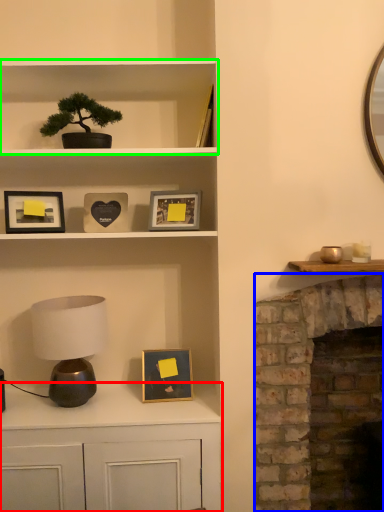
Question: Which object is the closest to the cabinetry (highlighted by a red box)? Choose among these: fireplace (highlighted by a blue box) or shelf (highlighted by a green box).

Choices:
 (A) fireplace
 (B) shelf

Answer: (A)